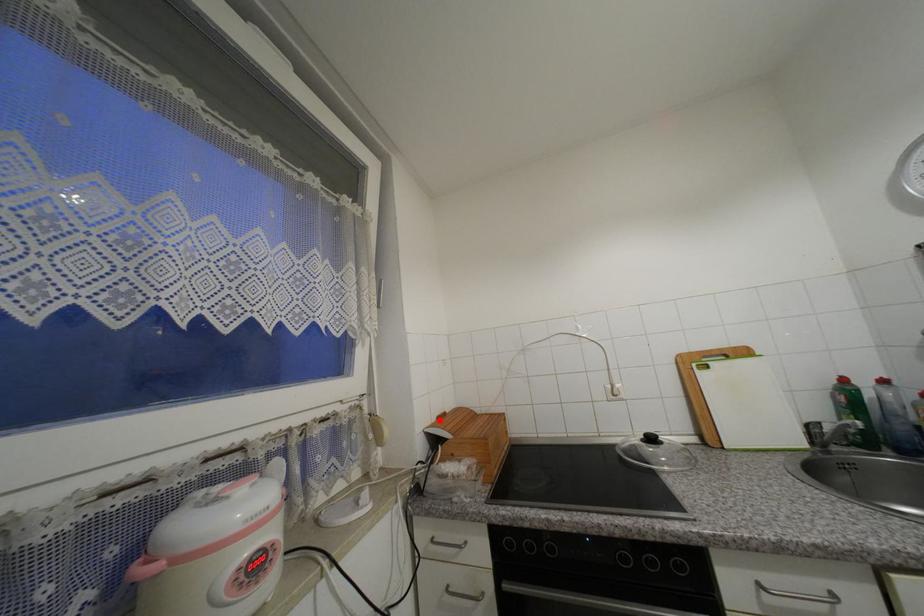
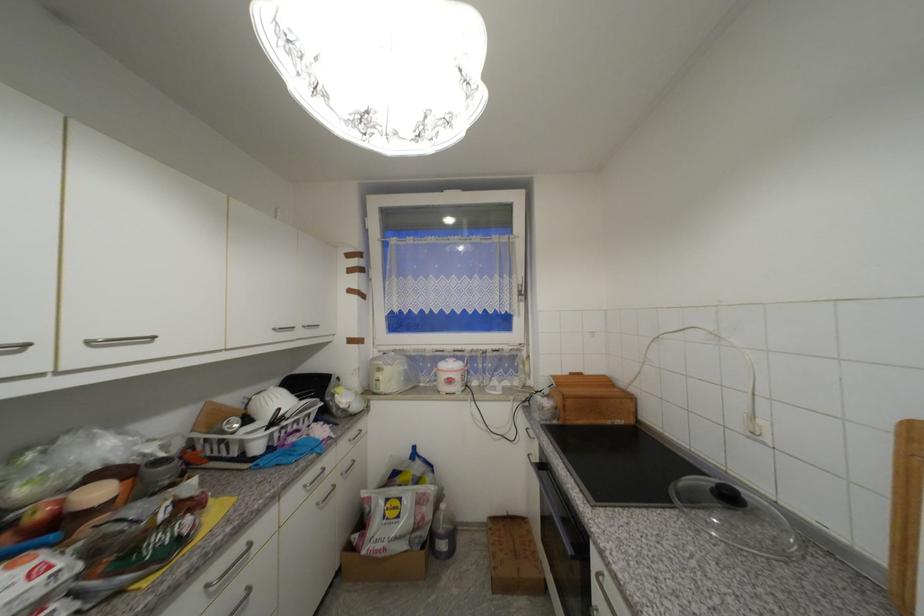
Locate, in the second image, the point that corresponds to the highlighted location in the first image.

(572, 374)